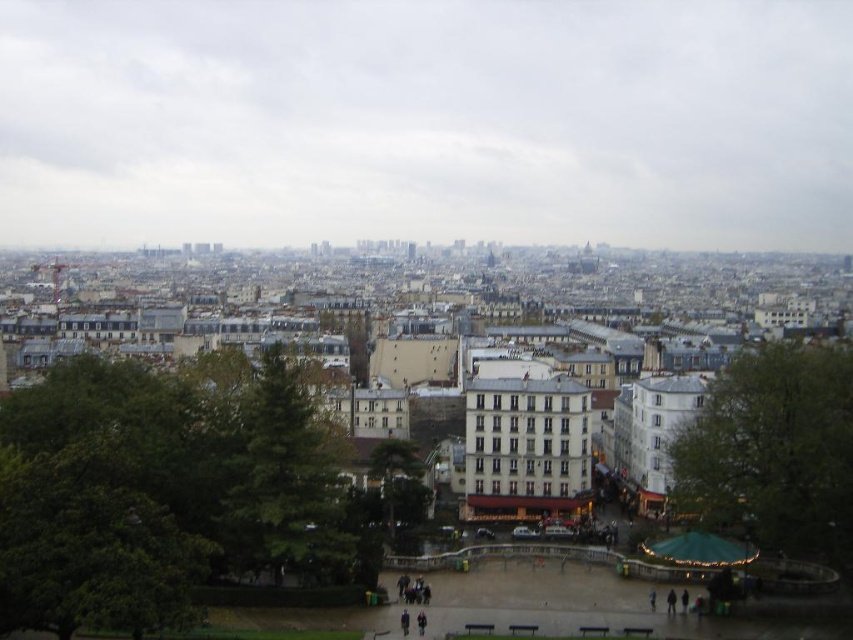
Question: Estimate the real-world distances between objects in this image. Which object is closer to the green textured tree at center-left?

Choices:
 (A) dark clothing at center
 (B) green textured tree at center

Answer: (B)

Question: Does green textured tree at center have a smaller size compared to dark clothing at center?

Choices:
 (A) no
 (B) yes

Answer: (A)

Question: Estimate the real-world distances between objects in this image. Which object is farther from the dark clothing at center?

Choices:
 (A) white cloudy sky at upper center
 (B) green leafy tree at center
 (C) green textured tree at center-left

Answer: (A)

Question: Does green leafy tree at center have a greater width compared to dark clothing at center?

Choices:
 (A) no
 (B) yes

Answer: (B)

Question: Can you confirm if green leafy tree at center is positioned to the left of green textured tree at center?

Choices:
 (A) yes
 (B) no

Answer: (B)

Question: Among these objects, which one is nearest to the camera?

Choices:
 (A) green textured tree at center
 (B) white cloudy sky at upper center
 (C) green textured tree at center-left

Answer: (C)